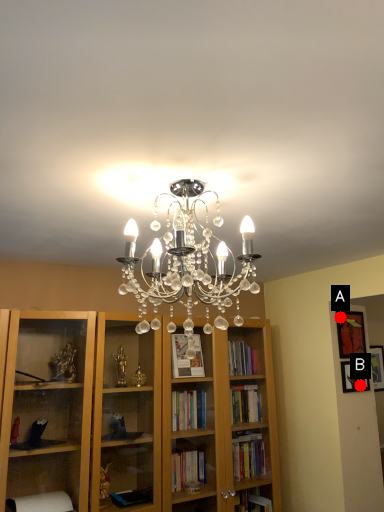
Question: Two points are circled on the image, labeled by A and B beside each circle. Among these points, which one is farthest from the camera?

Choices:
 (A) A is further
 (B) B is further

Answer: (A)